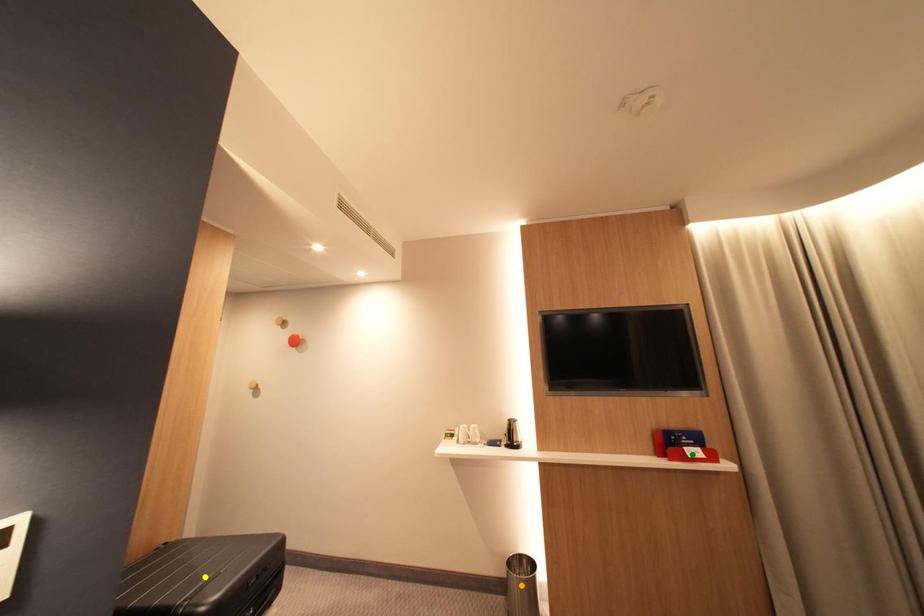
Order these from nearest to farthest:
orange point, green point, yellow point

yellow point, green point, orange point